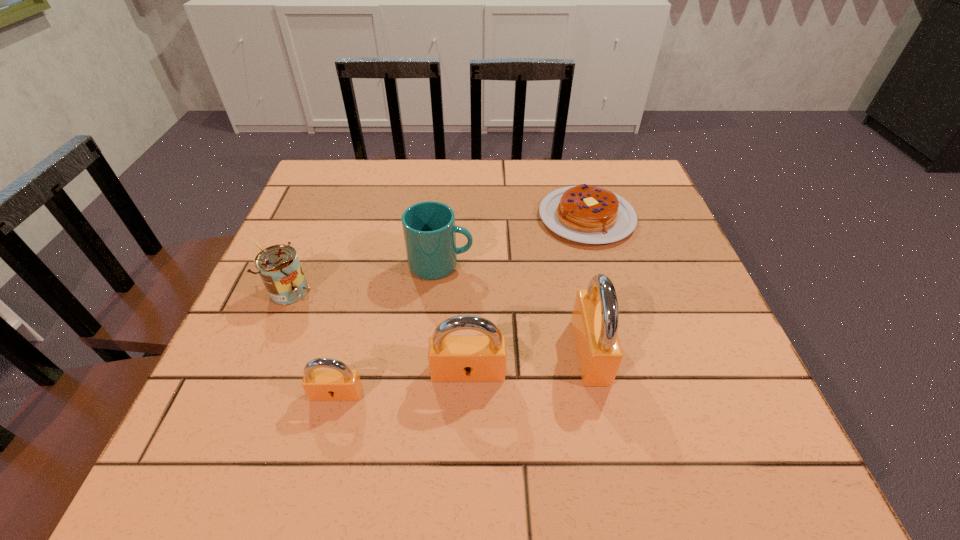
Find the location of a particular element. the fifth closest object to the pancake is located at coordinates (341, 384).

Identify which object is located as the third nearest to the second tallest padlock. Please provide its 2D coordinates. Your answer should be formatted as a tuple, i.e. [(x, y)], where the tuple contains the x and y coordinates of a point satisfying the conditions above.

[(429, 228)]

The image size is (960, 540). Find the location of `padlock identified as the third closest to the cup`. padlock identified as the third closest to the cup is located at coordinates (341, 384).

Select which padlock appears as the closest to the cup. Please provide its 2D coordinates. Your answer should be formatted as a tuple, i.e. [(x, y)], where the tuple contains the x and y coordinates of a point satisfying the conditions above.

[(451, 358)]

Where is `free point that satisfies the following two spatial constraints: 1. on the handle side of the cup; 2. to unlock the fifth object from right to left from the front`? free point that satisfies the following two spatial constraints: 1. on the handle side of the cup; 2. to unlock the fifth object from right to left from the front is located at coordinates [x=429, y=394].

Find the location of a particular element. The width and height of the screenshot is (960, 540). free location that satisfies the following two spatial constraints: 1. on the handle side of the cup; 2. to unlock the leftmost padlock from the front is located at coordinates (429, 394).

At what (x,y) coordinates should I click in order to perform the action: click on free spot that satisfies the following two spatial constraints: 1. on the front side of the pancake; 2. to unlock the rightmost padlock from the front. Please return your answer as a coordinate pair (x, y). The image size is (960, 540). Looking at the image, I should click on (624, 352).

Identify the location of free region that satisfies the following two spatial constraints: 1. to unlock the rightmost padlock from the front; 2. to unlock the fifth object from right to left from the front. (599, 394).